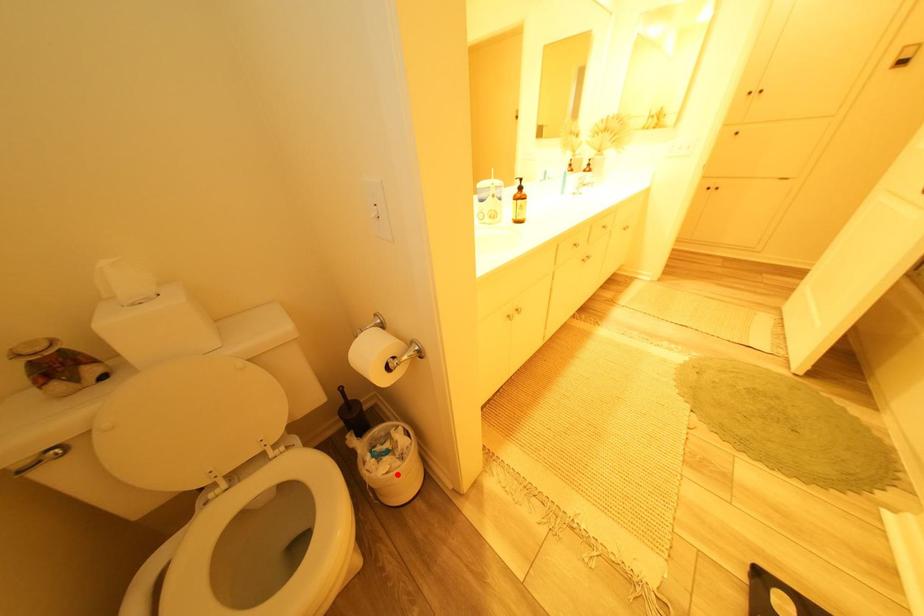
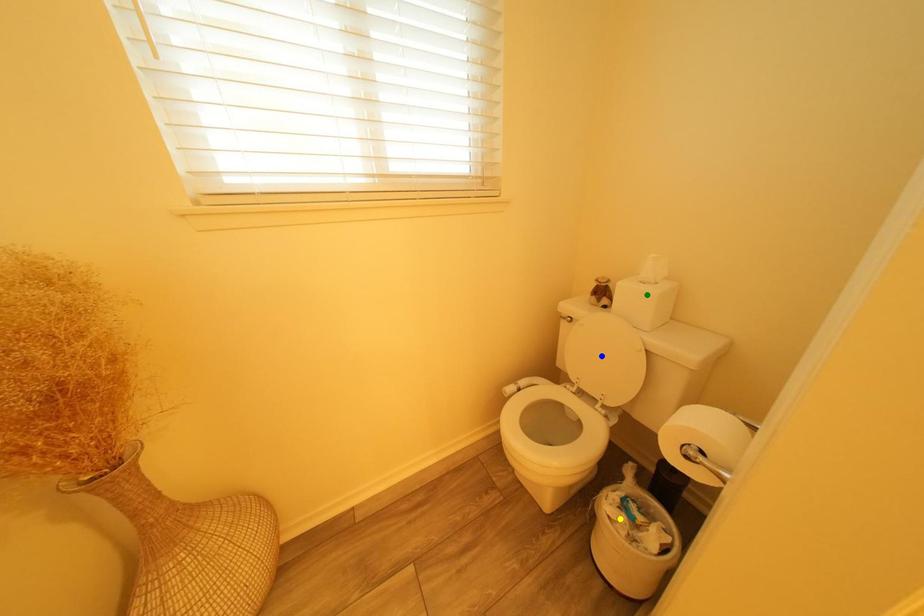
Question: I am providing you with two images of the same scene from different viewpoints. A red point is marked on the first image. You are given multiple points on the second image. Which point in image 2 is actually the same real-world point as the red point in image 1?

Choices:
 (A) green point
 (B) yellow point
 (C) blue point

Answer: (B)